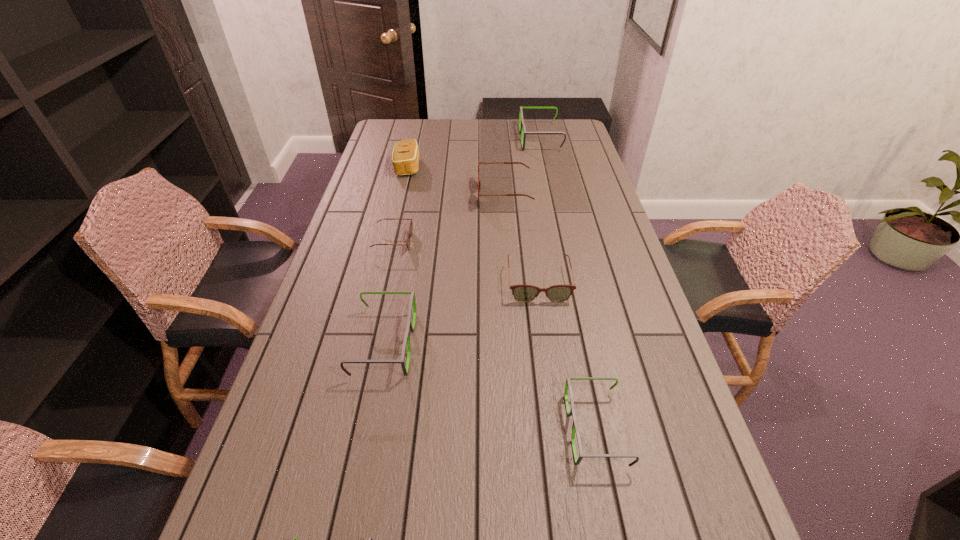
Locate an element on the screen. The height and width of the screenshot is (540, 960). vacant space located at the front view of the sixth nearest object is located at coordinates (391, 195).

At what (x,y) coordinates should I click in order to perform the action: click on free spot located 0.300m on the lens of the third nearest spectacles. Please return your answer as a coordinate pair (x, y). Looking at the image, I should click on (530, 343).

Where is `vacant space situated at the front view of the fourth farthest spectacles`? vacant space situated at the front view of the fourth farthest spectacles is located at coordinates (548, 355).

Image resolution: width=960 pixels, height=540 pixels. In order to click on free space located on the lens of the seventh farthest object in this screenshot , I will do `click(398, 429)`.

Where is `vacant space located 0.390m on the lens of the seventh farthest object`? Image resolution: width=960 pixels, height=540 pixels. vacant space located 0.390m on the lens of the seventh farthest object is located at coordinates (389, 429).

Image resolution: width=960 pixels, height=540 pixels. Find the location of `vacant region located 0.110m on the lens of the seventh farthest object`. vacant region located 0.110m on the lens of the seventh farthest object is located at coordinates (518, 429).

You are a GUI agent. You are given a task and a screenshot of the screen. Output one action in this format:
    pyautogui.click(x=<x>, y=<y>)
    Task: Click on the vacant region located at the front view of the second farthest brown spectacles
    
    Given the screenshot: What is the action you would take?
    pyautogui.click(x=514, y=242)

Locate an element on the screen. object that is at the far edge is located at coordinates click(522, 129).

Identify the location of clutch bag situated at the left edge. The height and width of the screenshot is (540, 960). pos(405,157).

Identify the location of object situated at the far right corner. (522, 129).